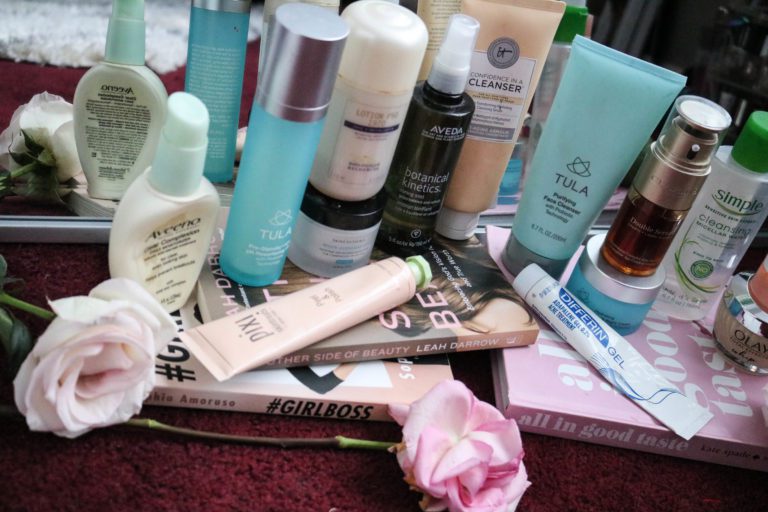
The image size is (768, 512). Identify the location of red capet. (160, 460).